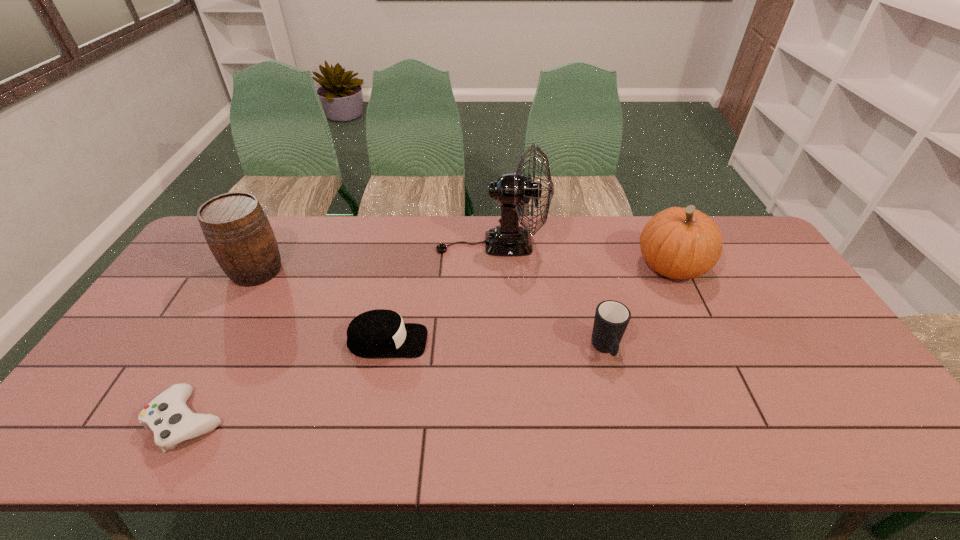
This screenshot has height=540, width=960. I want to click on vacant space that's between the nearest object and the second shortest object, so click(x=288, y=381).

This screenshot has height=540, width=960. What are the coordinates of `vacant point located between the nearest object and the cider` in the screenshot? It's located at (222, 346).

This screenshot has width=960, height=540. Find the location of `vacant space in between the rightmost object and the second shortest object`. vacant space in between the rightmost object and the second shortest object is located at coordinates (529, 304).

The height and width of the screenshot is (540, 960). I want to click on free point between the pumpkin and the control, so click(429, 343).

This screenshot has height=540, width=960. I want to click on vacant area that lies between the fifth object from left to right and the rightmost object, so click(638, 308).

At what (x,y) coordinates should I click in order to perform the action: click on free space between the mug and the shortest object. Please return your answer as a coordinate pair (x, y). Image resolution: width=960 pixels, height=540 pixels. Looking at the image, I should click on (396, 385).

Find the location of a particular element. This screenshot has height=540, width=960. vacant region between the tallest object and the nearest object is located at coordinates (340, 332).

Identify the location of free space between the cider and the cap. The height and width of the screenshot is (540, 960). click(322, 306).

Where is `the second closest object to the tallest object`? The width and height of the screenshot is (960, 540). the second closest object to the tallest object is located at coordinates (611, 319).

You are a GUI agent. You are given a task and a screenshot of the screen. Output one action in this format:
    pyautogui.click(x=<x>, y=<y>)
    Task: Click on the second closest object to the tallest object
    This screenshot has width=960, height=540.
    Given the screenshot: What is the action you would take?
    pyautogui.click(x=611, y=319)